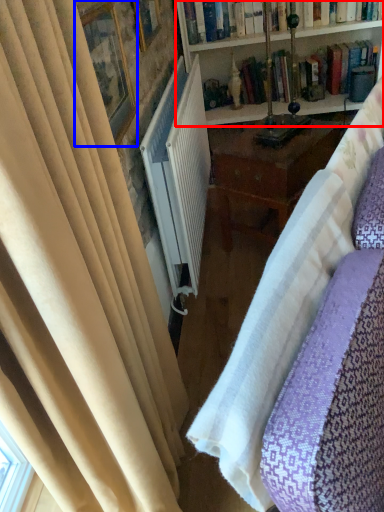
Question: Which object appears farthest to the camera in this image, bookcase (highlighted by a red box) or picture frame (highlighted by a blue box)?

Choices:
 (A) bookcase
 (B) picture frame

Answer: (A)